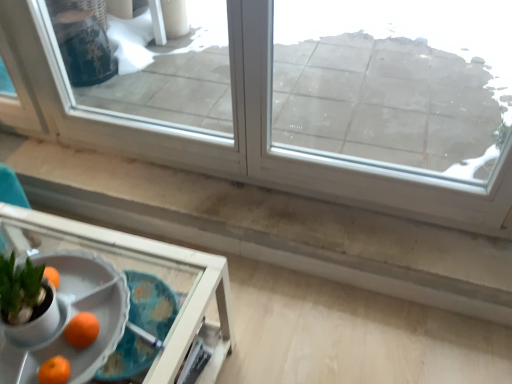
Image resolution: width=512 pixels, height=384 pixels. In order to click on vacant region to the left of orange matte at lower left in this screenshot , I will do `click(36, 347)`.